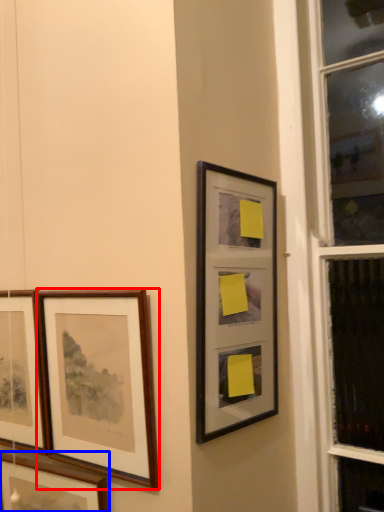
Question: Among these objects, which one is farthest to the camera, picture frame (highlighted by a red box) or picture frame (highlighted by a blue box)?

Choices:
 (A) picture frame
 (B) picture frame

Answer: (B)